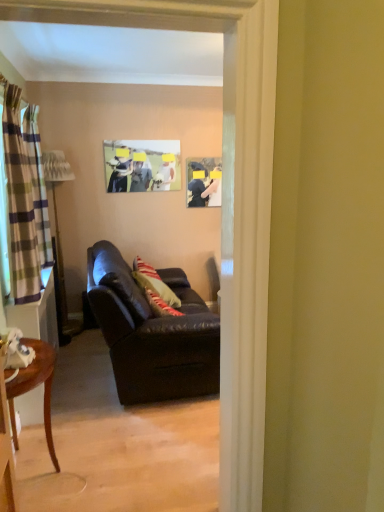
Describe the element at coordinates (25, 198) in the screenshot. I see `striped fabric curtain at left, the 1th curtain positioned from the right` at that location.

I want to click on striped fabric curtain at left, the 1th curtain in the front-to-back sequence, so click(25, 198).

What is the approximate height of mahogany wood side table at lower left?

It is 27.21 inches.

At what (x,y) coordinates should I click in order to perform the action: click on matte black picture frame at upper center, acting as the first picture frame starting from the right. Please return your answer as a coordinate pair (x, y). Image resolution: width=384 pixels, height=512 pixels. Looking at the image, I should click on (204, 182).

What do you see at coordinates (142, 165) in the screenshot? The image size is (384, 512). I see `matte plastic picture frame at upper center, which is the first picture frame in left-to-right order` at bounding box center [142, 165].

Measure the distance between point (x=103, y=241) and camera.

4.32 meters.

What is the approximate height of leather couch at center?

leather couch at center is 38.90 inches tall.

The width and height of the screenshot is (384, 512). I want to click on striped fabric curtain at left, positioned as the second curtain in back-to-front order, so click(x=25, y=198).

From the image's perspective, which one is positioned lower, plaid fabric curtain at left, positioned as the 1th curtain in left-to-right order, or leather couch at center?

leather couch at center appears lower in the image.

How many degrees apart are the facing directions of plaid fabric curtain at left, positioned as the 1th curtain in left-to-right order, and leather couch at center?

plaid fabric curtain at left, positioned as the 1th curtain in left-to-right order, and leather couch at center are facing 0.733 degrees away from each other.

From a real-world perspective, is plaid fabric curtain at left, which is counted as the 1th curtain, starting from the back, located beneath leather couch at center?

Actually, plaid fabric curtain at left, which is counted as the 1th curtain, starting from the back, is physically above leather couch at center in the real world.

Consider the image. Is plaid fabric curtain at left, which is counted as the second curtain, starting from the right, far away from leather couch at center?

No, plaid fabric curtain at left, which is counted as the second curtain, starting from the right, is not far from leather couch at center.

Which object is thinner, mahogany wood side table at lower left or matte black picture frame at upper center, acting as the second picture frame starting from the left?

Thinner between the two is matte black picture frame at upper center, acting as the second picture frame starting from the left.

Which object is closer to the camera, mahogany wood side table at lower left or matte black picture frame at upper center, acting as the first picture frame starting from the right?

mahogany wood side table at lower left.

From the image's perspective, between mahogany wood side table at lower left and matte black picture frame at upper center, acting as the first picture frame starting from the right, who is located below?

From the image's view, mahogany wood side table at lower left is below.

Who is shorter, leather couch at center or mahogany wood side table at lower left?

Standing shorter between the two is mahogany wood side table at lower left.

Consider the image. From a real-world perspective, relative to mahogany wood side table at lower left, is leather couch at center vertically above or below?

leather couch at center is above mahogany wood side table at lower left.

How far apart are leather couch at center and mahogany wood side table at lower left?

leather couch at center is 33.70 inches from mahogany wood side table at lower left.

Would you say matte black picture frame at upper center, acting as the second picture frame starting from the left, is to the left or to the right of leather couch at center in the picture?

In the image, matte black picture frame at upper center, acting as the second picture frame starting from the left, appears on the right side of leather couch at center.

From a real-world perspective, does matte black picture frame at upper center, acting as the first picture frame starting from the right, stand above leather couch at center?

Correct, in the physical world, matte black picture frame at upper center, acting as the first picture frame starting from the right, is higher than leather couch at center.

Between matte black picture frame at upper center, acting as the second picture frame starting from the left, and leather couch at center, which one has smaller size?

matte black picture frame at upper center, acting as the second picture frame starting from the left.

What's the angular difference between matte black picture frame at upper center, acting as the second picture frame starting from the left, and leather couch at center's facing directions?

There is a 90.1-degree angle between the facing directions of matte black picture frame at upper center, acting as the second picture frame starting from the left, and leather couch at center.

How different are the orientations of mahogany wood side table at lower left and striped fabric curtain at left, the 1th curtain positioned from the right, in degrees?

They differ by 0.0266 degrees in their facing directions.

From a real-world perspective, is mahogany wood side table at lower left over striped fabric curtain at left, marked as the 2th curtain in a left-to-right arrangement?

No, from a real-world perspective, mahogany wood side table at lower left is not above striped fabric curtain at left, marked as the 2th curtain in a left-to-right arrangement.

Considering the points (20, 380) and (10, 260), which point is in front, point (20, 380) or point (10, 260)?

The point (20, 380) is closer.

This screenshot has height=512, width=384. There is a mahogany wood side table at lower left. In order to click on the 1st curtain above it (from the image's perspective) in this screenshot , I will do `click(25, 198)`.

Can you tell me how much plaid fabric curtain at left, positioned as the 2th curtain in front-to-back order, and mahogany wood side table at lower left differ in facing direction?

They differ by 2.84 degrees in their facing directions.

Which object is positioned more to the left, plaid fabric curtain at left, which is counted as the second curtain, starting from the right, or mahogany wood side table at lower left?

plaid fabric curtain at left, which is counted as the second curtain, starting from the right, is more to the left.

Which point is more forward, (50, 242) or (45, 401)?

The point (45, 401) is closer.

Is plaid fabric curtain at left, which is counted as the 1th curtain, starting from the back, positioned far away from mahogany wood side table at lower left?

They are positioned close to each other.

Considering the positions of objects striped fabric curtain at left, the 1th curtain in the front-to-back sequence, and mahogany wood side table at lower left in the image provided, who is more to the left, striped fabric curtain at left, the 1th curtain in the front-to-back sequence, or mahogany wood side table at lower left?

Positioned to the left is striped fabric curtain at left, the 1th curtain in the front-to-back sequence.

From a real-world perspective, is striped fabric curtain at left, positioned as the second curtain in back-to-front order, below mahogany wood side table at lower left?

No, from a real-world perspective, striped fabric curtain at left, positioned as the second curtain in back-to-front order, is not under mahogany wood side table at lower left.

I want to click on table in front of the striped fabric curtain at left, the 1th curtain in the front-to-back sequence, so click(x=35, y=387).

Which object is closer to the camera, striped fabric curtain at left, positioned as the second curtain in back-to-front order, or mahogany wood side table at lower left?

mahogany wood side table at lower left.

In order to click on studio couch in front of the plaid fabric curtain at left, which is counted as the second curtain, starting from the right in this screenshot , I will do `click(153, 334)`.

Find the location of a particular element. The height and width of the screenshot is (512, 384). table below the matte black picture frame at upper center, acting as the second picture frame starting from the left (from a real-world perspective) is located at coordinates (35, 387).

Estimate the real-world distances between objects in this image. Which object is closer to matte black picture frame at upper center, acting as the second picture frame starting from the left, matte plastic picture frame at upper center, which is the first picture frame in left-to-right order, or striped fabric curtain at left, the 1th curtain positioned from the right?

matte plastic picture frame at upper center, which is the first picture frame in left-to-right order.

When comparing their distances from leather couch at center, does matte black picture frame at upper center, acting as the first picture frame starting from the right, or striped fabric curtain at left, marked as the 2th curtain in a left-to-right arrangement, seem further?

The object further to leather couch at center is matte black picture frame at upper center, acting as the first picture frame starting from the right.

When comparing their distances from leather couch at center, does matte black picture frame at upper center, acting as the first picture frame starting from the right, or matte plastic picture frame at upper center, the second picture frame positioned from the right, seem closer?

matte plastic picture frame at upper center, the second picture frame positioned from the right, is positioned closer to the anchor leather couch at center.

Which object lies nearer to the anchor point matte plastic picture frame at upper center, the second picture frame positioned from the right, mahogany wood side table at lower left or matte black picture frame at upper center, acting as the second picture frame starting from the left?

The object closer to matte plastic picture frame at upper center, the second picture frame positioned from the right, is matte black picture frame at upper center, acting as the second picture frame starting from the left.

Considering their positions, is plaid fabric curtain at left, which is counted as the 1th curtain, starting from the back, positioned further to leather couch at center than matte black picture frame at upper center, acting as the first picture frame starting from the right?

Among the two, matte black picture frame at upper center, acting as the first picture frame starting from the right, is located further to leather couch at center.

Considering their positions, is plaid fabric curtain at left, positioned as the 1th curtain in left-to-right order, positioned closer to matte plastic picture frame at upper center, the second picture frame positioned from the right, than matte black picture frame at upper center, acting as the second picture frame starting from the left?

matte black picture frame at upper center, acting as the second picture frame starting from the left.

Which object lies further to the anchor point matte black picture frame at upper center, acting as the first picture frame starting from the right, leather couch at center or matte plastic picture frame at upper center, the second picture frame positioned from the right?

The object further to matte black picture frame at upper center, acting as the first picture frame starting from the right, is leather couch at center.

Which object lies further to the anchor point matte black picture frame at upper center, acting as the second picture frame starting from the left, plaid fabric curtain at left, which is counted as the second curtain, starting from the right, or striped fabric curtain at left, the 1th curtain positioned from the right?

striped fabric curtain at left, the 1th curtain positioned from the right, is positioned further to the anchor matte black picture frame at upper center, acting as the second picture frame starting from the left.

Identify the location of picture frame between plaid fabric curtain at left, which is counted as the 1th curtain, starting from the back, and matte black picture frame at upper center, acting as the first picture frame starting from the right, along the z-axis. The width and height of the screenshot is (384, 512). (142, 165).

Identify the location of picture frame positioned between mahogany wood side table at lower left and matte black picture frame at upper center, acting as the first picture frame starting from the right, from near to far. (142, 165).

Image resolution: width=384 pixels, height=512 pixels. What are the coordinates of `curtain between leather couch at center and matte plastic picture frame at upper center, which is the first picture frame in left-to-right order, from front to back` in the screenshot? It's located at tap(38, 183).

At what (x,y) coordinates should I click in order to perform the action: click on studio couch between mahogany wood side table at lower left and matte plastic picture frame at upper center, which is the first picture frame in left-to-right order, from front to back. Please return your answer as a coordinate pair (x, y). Looking at the image, I should click on (153, 334).